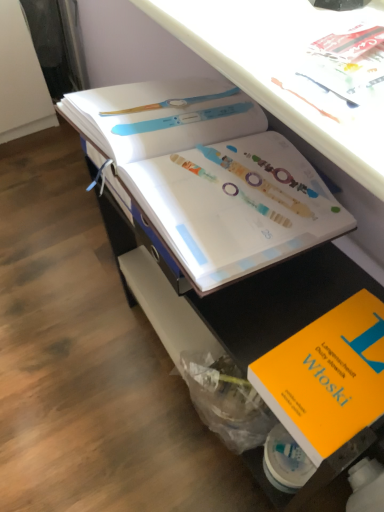
Question: Is white paper book at center, which appears as the first book when viewed from the top, positioned with its back to orange matte book at lower right, which ranks as the 1th book in bottom-to-top order?

Choices:
 (A) no
 (B) yes

Answer: (A)

Question: From the image's perspective, is white paper book at center, which appears as the first book when viewed from the top, under orange matte book at lower right, the 2th book when ordered from top to bottom?

Choices:
 (A) no
 (B) yes

Answer: (A)

Question: Considering the relative positions of white paper book at center, marked as the second book in a bottom-to-top arrangement, and orange matte book at lower right, which ranks as the 1th book in bottom-to-top order, in the image provided, is white paper book at center, marked as the second book in a bottom-to-top arrangement, to the left of orange matte book at lower right, which ranks as the 1th book in bottom-to-top order, from the viewer's perspective?

Choices:
 (A) yes
 (B) no

Answer: (A)

Question: Can you confirm if white paper book at center, which appears as the first book when viewed from the top, is bigger than orange matte book at lower right, which ranks as the 1th book in bottom-to-top order?

Choices:
 (A) no
 (B) yes

Answer: (B)

Question: Does white paper book at center, which appears as the first book when viewed from the top, have a greater height compared to orange matte book at lower right, the 2th book when ordered from top to bottom?

Choices:
 (A) no
 (B) yes

Answer: (B)

Question: Considering the relative sizes of white paper book at center, which appears as the first book when viewed from the top, and orange matte book at lower right, which ranks as the 1th book in bottom-to-top order, in the image provided, is white paper book at center, which appears as the first book when viewed from the top, thinner than orange matte book at lower right, which ranks as the 1th book in bottom-to-top order,?

Choices:
 (A) yes
 (B) no

Answer: (B)

Question: Does orange matte book at lower right, which ranks as the 1th book in bottom-to-top order, lie behind white paper book at center, which appears as the first book when viewed from the top?

Choices:
 (A) no
 (B) yes

Answer: (A)

Question: Can you confirm if orange matte book at lower right, the 2th book when ordered from top to bottom, is positioned to the left of white paper book at center, which appears as the first book when viewed from the top?

Choices:
 (A) no
 (B) yes

Answer: (A)

Question: From the image's perspective, does orange matte book at lower right, the 2th book when ordered from top to bottom, appear higher than white paper book at center, which appears as the first book when viewed from the top?

Choices:
 (A) no
 (B) yes

Answer: (A)

Question: Can you confirm if orange matte book at lower right, which ranks as the 1th book in bottom-to-top order, is smaller than white paper book at center, which appears as the first book when viewed from the top?

Choices:
 (A) no
 (B) yes

Answer: (B)

Question: From a real-world perspective, is orange matte book at lower right, the 2th book when ordered from top to bottom, located higher than white paper book at center, marked as the second book in a bottom-to-top arrangement?

Choices:
 (A) no
 (B) yes

Answer: (A)

Question: Can you confirm if orange matte book at lower right, the 2th book when ordered from top to bottom, is thinner than white paper book at center, marked as the second book in a bottom-to-top arrangement?

Choices:
 (A) yes
 (B) no

Answer: (A)

Question: Is orange matte book at lower right, which ranks as the 1th book in bottom-to-top order, wider or thinner than white paper book at center, marked as the second book in a bottom-to-top arrangement?

Choices:
 (A) thin
 (B) wide

Answer: (A)